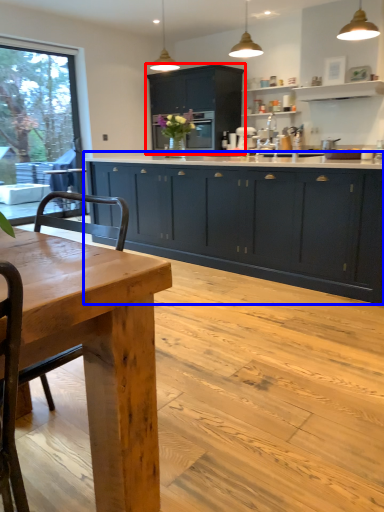
Question: Among these objects, which one is farthest to the camera, cabinetry (highlighted by a red box) or cabinetry (highlighted by a blue box)?

Choices:
 (A) cabinetry
 (B) cabinetry

Answer: (A)